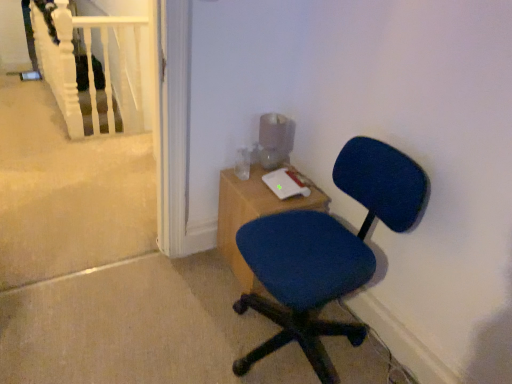
Describe the element at coordinates (326, 252) in the screenshot. This screenshot has width=512, height=384. I see `blue fabric chair at center` at that location.

Find the location of a particular element. This screenshot has height=384, width=512. wooden desk at center is located at coordinates (253, 215).

This screenshot has width=512, height=384. What are the coordinates of `blue fabric chair at center` in the screenshot? It's located at (326, 252).

Measure the distance from wooden desk at center to white matte rail at upper left.

1.50 meters.

From the image's perspective, is wooden desk at center above or below white matte rail at upper left?

Based on their image positions, wooden desk at center is located beneath white matte rail at upper left.

Does wooden desk at center turn towards white matte rail at upper left?

No, wooden desk at center is not aimed at white matte rail at upper left.

Relative to white matte rail at upper left, is wooden desk at center in front or behind?

In the image, wooden desk at center appears in front of white matte rail at upper left.

Considering the positions of point (124, 101) and point (257, 201), is point (124, 101) closer or farther from the camera than point (257, 201)?

Clearly, point (124, 101) is more distant from the camera than point (257, 201).

Which object is wider, white matte rail at upper left or wooden desk at center?

Wider between the two is wooden desk at center.

How different are the orientations of white matte rail at upper left and wooden desk at center in degrees?

They differ by 0.835 degrees in their facing directions.

In the scene shown: Would you consider white matte rail at upper left to be distant from wooden desk at center?

That's right, there is a large distance between white matte rail at upper left and wooden desk at center.

Considering the sizes of objects blue fabric chair at center and wooden desk at center in the image provided, who is taller, blue fabric chair at center or wooden desk at center?

With more height is blue fabric chair at center.

Consider the image. Which point is more distant from viewer, (x=307, y=243) or (x=244, y=265)?

Positioned behind is point (x=244, y=265).

Is blue fabric chair at center at the left side of wooden desk at center?

No.

Consider the image. Does blue fabric chair at center lie in front of wooden desk at center?

Yes, the depth of blue fabric chair at center is less than that of wooden desk at center.

From a real-world perspective, which object stands above the other?

From a 3D spatial view, blue fabric chair at center is above.

Can you confirm if wooden desk at center is taller than blue fabric chair at center?

No, wooden desk at center is not taller than blue fabric chair at center.

Can you tell me how much wooden desk at center and blue fabric chair at center differ in facing direction?

The facing directions of wooden desk at center and blue fabric chair at center are 87 degrees apart.

Is blue fabric chair at center at the back of wooden desk at center?

wooden desk at center does not have its back to blue fabric chair at center.

Is point (47, 62) positioned after point (339, 273)?

Yes.

Would you say white matte rail at upper left is a long distance from blue fabric chair at center?

Yes, white matte rail at upper left is far from blue fabric chair at center.

Is white matte rail at upper left looking in the opposite direction of blue fabric chair at center?

No, white matte rail at upper left's orientation is not away from blue fabric chair at center.

Is white matte rail at upper left not inside blue fabric chair at center?

Absolutely, white matte rail at upper left is external to blue fabric chair at center.

Would you say blue fabric chair at center contains white matte rail at upper left?

No, white matte rail at upper left is not a part of blue fabric chair at center.

Who is more distant, blue fabric chair at center or white matte rail at upper left?

white matte rail at upper left is more distant.

Is point (336, 233) in front of point (138, 44)?

That is True.

Measure the distance from blue fabric chair at center to white matte rail at upper left.

The distance of blue fabric chair at center from white matte rail at upper left is 1.97 meters.

At what (x,y) coordinates should I click in order to perform the action: click on rail above the wooden desk at center (from a real-world perspective). Please return your answer as a coordinate pair (x, y). This screenshot has width=512, height=384. Looking at the image, I should click on (95, 70).

This screenshot has height=384, width=512. Identify the location of rail behind the wooden desk at center. (95, 70).

Looking at the image, which one is located further to wooden desk at center, white matte rail at upper left or blue fabric chair at center?

white matte rail at upper left is further to wooden desk at center.

When comparing their distances from blue fabric chair at center, does white matte rail at upper left or wooden desk at center seem further?

white matte rail at upper left is further to blue fabric chair at center.

Estimate the real-world distances between objects in this image. Which object is closer to wooden desk at center, blue fabric chair at center or white matte rail at upper left?

blue fabric chair at center is closer to wooden desk at center.

Based on their spatial positions, is wooden desk at center or white matte rail at upper left closer to blue fabric chair at center?

Among the two, wooden desk at center is located nearer to blue fabric chair at center.

Which object lies further to the anchor point white matte rail at upper left, blue fabric chair at center or wooden desk at center?

blue fabric chair at center is further to white matte rail at upper left.

Considering their positions, is wooden desk at center positioned closer to white matte rail at upper left than blue fabric chair at center?

The object closer to white matte rail at upper left is wooden desk at center.

At what (x,y) coordinates should I click in order to perform the action: click on desk located between blue fabric chair at center and white matte rail at upper left in the depth direction. Please return your answer as a coordinate pair (x, y). The image size is (512, 384). Looking at the image, I should click on (253, 215).